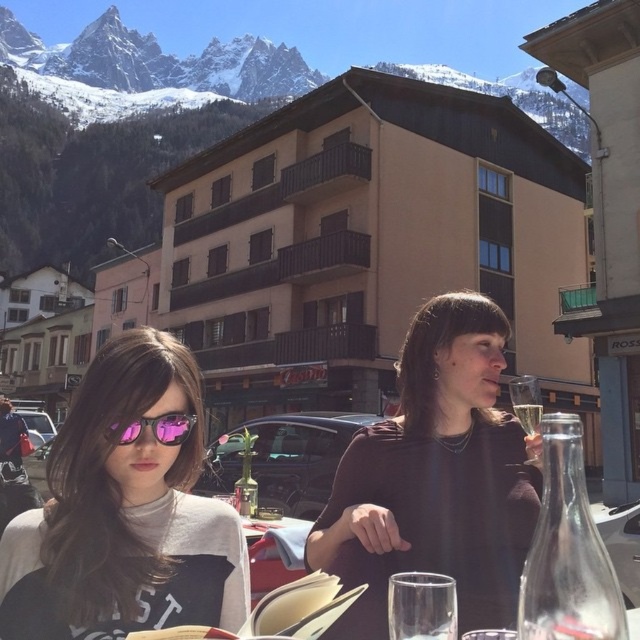
Question: Which point appears farthest from the camera in this image?

Choices:
 (A) (188, 428)
 (B) (525, 406)
 (C) (413, 428)
 (D) (42, 564)

Answer: (C)

Question: Which object is the farthest from the snowy rock mountain at upper left?

Choices:
 (A) clear glass wine at upper right
 (B) pink reflective sunglasses at left
 (C) clear glass flute at upper right

Answer: (C)

Question: Based on their relative distances, which object is nearer to the snowy rock mountain at upper left?

Choices:
 (A) pink reflective sunglasses at left
 (B) matte black dress at center

Answer: (B)

Question: Is matte black dress at center thinner than snowy rock mountain at upper left?

Choices:
 (A) no
 (B) yes

Answer: (B)

Question: Considering the relative positions of pink reflective sunglasses at left and snowy rock mountain at upper left in the image provided, where is pink reflective sunglasses at left located with respect to snowy rock mountain at upper left?

Choices:
 (A) left
 (B) right

Answer: (B)

Question: In this image, where is pink reflective sunglasses at left located relative to transparent glass at lower center?

Choices:
 (A) left
 (B) right

Answer: (A)